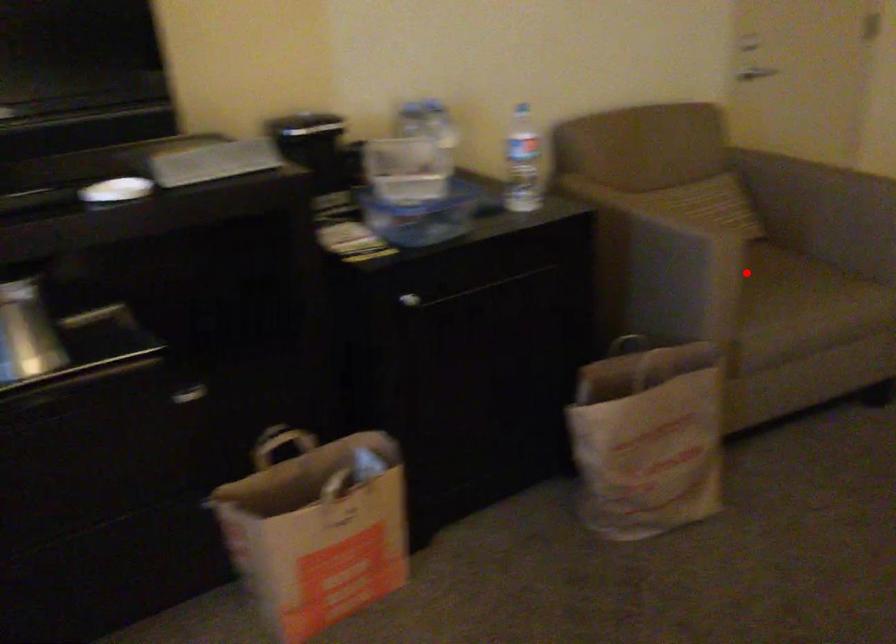
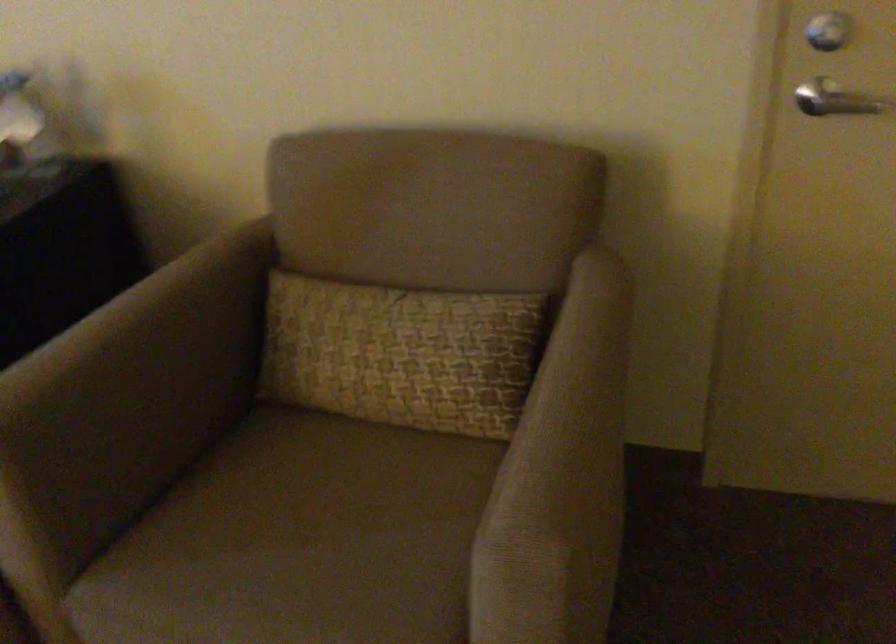
In the second image, find the point that corresponds to the highlighted location in the first image.

(314, 500)